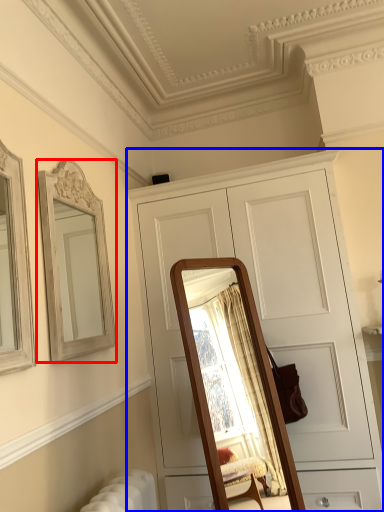
Question: Which point is closer to the camera, mirror (highlighted by a red box) or cabinetry (highlighted by a blue box)?

Choices:
 (A) mirror
 (B) cabinetry

Answer: (A)